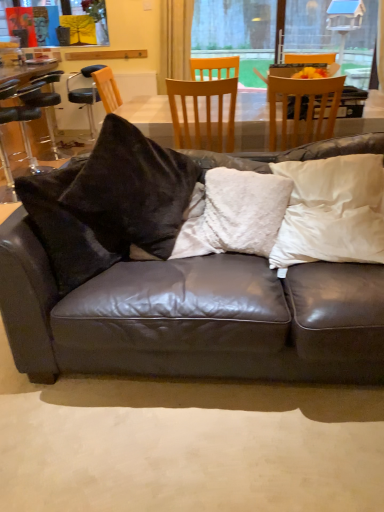
Describe the element at coordinates (300, 106) in the screenshot. I see `light brown wooden chair at upper center, the 3th chair from the left` at that location.

How much space does black leather bar stool at left, which is counted as the third chair, starting from the front, occupy vertically?

The height of black leather bar stool at left, which is counted as the third chair, starting from the front, is 34.92 inches.

This screenshot has height=512, width=384. Describe the element at coordinates (24, 138) in the screenshot. I see `black leather bar stool at left, which is the first chair in left-to-right order` at that location.

The image size is (384, 512). What are the coordinates of `matte black leather couch at center` in the screenshot? It's located at 192,317.

Is point (309, 329) positioned in front of point (4, 123)?

Yes, point (309, 329) is closer to viewer.

Considering the relative positions of matte black leather couch at center and black leather bar stool at left, which is the first chair in left-to-right order, in the image provided, is matte black leather couch at center to the left or to the right of black leather bar stool at left, which is the first chair in left-to-right order,?

Based on their positions, matte black leather couch at center is located to the right of black leather bar stool at left, which is the first chair in left-to-right order.

Looking at this image, is matte black leather couch at center turned away from black leather bar stool at left, which is counted as the third chair, starting from the front?

That's not correct — matte black leather couch at center is not looking away from black leather bar stool at left, which is counted as the third chair, starting from the front.

Between matte black leather couch at center and black leather bar stool at left, the first chair positioned from the back, which one has less height?

Standing shorter between the two is matte black leather couch at center.

From their relative heights in the image, would you say light brown wooden chair at center, the 2th chair in the front-to-back sequence, is taller or shorter than black leather bar stool at left?

In the image, light brown wooden chair at center, the 2th chair in the front-to-back sequence, appears to be shorter than black leather bar stool at left.

Is light brown wooden chair at center, which is the second chair in left-to-right order, not inside black leather bar stool at left?

Yes, light brown wooden chair at center, which is the second chair in left-to-right order, is outside of black leather bar stool at left.

Considering the points (170, 93) and (35, 83), which point is behind, point (170, 93) or point (35, 83)?

The point (35, 83) is behind.

There is a black leather bar stool at left. What are the coordinates of `the 3rd chair above it (from a real-world perspective)` in the screenshot? It's located at (206, 108).

Considering the relative sizes of matte black leather couch at center and fluffy white pillow at center, which appears as the 1th pillow when viewed from the left, in the image provided, is matte black leather couch at center bigger than fluffy white pillow at center, which appears as the 1th pillow when viewed from the left,?

Correct, matte black leather couch at center is larger in size than fluffy white pillow at center, which appears as the 1th pillow when viewed from the left.

Is matte black leather couch at center wider than fluffy white pillow at center, the 2th pillow when ordered from right to left?

Correct, the width of matte black leather couch at center exceeds that of fluffy white pillow at center, the 2th pillow when ordered from right to left.

Could you tell me if matte black leather couch at center is turned towards fluffy white pillow at center, which appears as the 1th pillow when viewed from the left?

Yes, matte black leather couch at center is facing fluffy white pillow at center, which appears as the 1th pillow when viewed from the left.

From a real-world perspective, is matte black leather couch at center on top of fluffy white pillow at center, which appears as the 1th pillow when viewed from the left?

No.

Can you confirm if black leather bar stool at left is taller than fluffy white pillow at center, which appears as the 1th pillow when viewed from the left?

Yes, black leather bar stool at left is taller than fluffy white pillow at center, which appears as the 1th pillow when viewed from the left.

How far apart are black leather bar stool at left and fluffy white pillow at center, the 2th pillow when ordered from right to left?

black leather bar stool at left and fluffy white pillow at center, the 2th pillow when ordered from right to left, are 2.78 meters apart from each other.

Considering the sizes of objects black leather bar stool at left and fluffy white pillow at center, the 2th pillow when ordered from right to left, in the image provided, who is smaller, black leather bar stool at left or fluffy white pillow at center, the 2th pillow when ordered from right to left,?

fluffy white pillow at center, the 2th pillow when ordered from right to left, is smaller.

From the picture: Can you confirm if black leather bar stool at left is wider than fluffy white pillow at center, the 2th pillow when ordered from right to left?

Correct, the width of black leather bar stool at left exceeds that of fluffy white pillow at center, the 2th pillow when ordered from right to left.

Does light brown wooden chair at upper center, which appears as the first chair when viewed from the right, appear on the left side of black leather bar stool at left, which is the first chair in left-to-right order?

No.

Considering the relative sizes of light brown wooden chair at upper center, which is the 3th chair from back to front, and black leather bar stool at left, which is counted as the third chair, starting from the front, in the image provided, is light brown wooden chair at upper center, which is the 3th chair from back to front, bigger than black leather bar stool at left, which is counted as the third chair, starting from the front,?

Incorrect, light brown wooden chair at upper center, which is the 3th chair from back to front, is not larger than black leather bar stool at left, which is counted as the third chair, starting from the front.

How different are the orientations of light brown wooden chair at upper center, which is the 3th chair from back to front, and black leather bar stool at left, placed as the third chair when sorted from right to left, in degrees?

The angle between the facing direction of light brown wooden chair at upper center, which is the 3th chair from back to front, and the facing direction of black leather bar stool at left, placed as the third chair when sorted from right to left, is 88.8 degrees.

Would you say yellow fabric at upper left is inside or outside black leather bar stool at left, placed as the third chair when sorted from right to left?

yellow fabric at upper left cannot be found inside black leather bar stool at left, placed as the third chair when sorted from right to left.

Considering the positions of objects yellow fabric at upper left and black leather bar stool at left, placed as the third chair when sorted from right to left, in the image provided, who is more to the left, yellow fabric at upper left or black leather bar stool at left, placed as the third chair when sorted from right to left,?

From the viewer's perspective, black leather bar stool at left, placed as the third chair when sorted from right to left, appears more on the left side.

Between yellow fabric at upper left and black leather bar stool at left, which is counted as the third chair, starting from the front, which one has more height?

black leather bar stool at left, which is counted as the third chair, starting from the front.

Considering the relative sizes of yellow fabric at upper left and black leather bar stool at left, placed as the third chair when sorted from right to left, in the image provided, is yellow fabric at upper left thinner than black leather bar stool at left, placed as the third chair when sorted from right to left,?

Yes.

From a real-world perspective, is light brown wooden chair at upper center, which appears as the first chair when viewed from the right, positioned under fluffy white pillow at center, which appears as the 1th pillow when viewed from the left, based on gravity?

No.

Considering the relative sizes of light brown wooden chair at upper center, the 3th chair from the left, and fluffy white pillow at center, the 2th pillow when ordered from right to left, in the image provided, is light brown wooden chair at upper center, the 3th chair from the left, shorter than fluffy white pillow at center, the 2th pillow when ordered from right to left,?

No.

From the image's perspective, does light brown wooden chair at upper center, which appears as the first chair when viewed from the right, appear higher than fluffy white pillow at center, which appears as the 1th pillow when viewed from the left?

Indeed, from the image's perspective, light brown wooden chair at upper center, which appears as the first chair when viewed from the right, is shown above fluffy white pillow at center, which appears as the 1th pillow when viewed from the left.

Considering the relative positions of light brown wooden chair at upper center, which appears as the first chair when viewed from the right, and fluffy white pillow at center, the 2th pillow when ordered from right to left, in the image provided, is light brown wooden chair at upper center, which appears as the first chair when viewed from the right, to the right of fluffy white pillow at center, the 2th pillow when ordered from right to left, from the viewer's perspective?

Correct, you'll find light brown wooden chair at upper center, which appears as the first chair when viewed from the right, to the right of fluffy white pillow at center, the 2th pillow when ordered from right to left.

This screenshot has height=512, width=384. I want to click on studio couch on the right of black leather bar stool at left, placed as the third chair when sorted from right to left, so click(x=192, y=317).

Find the location of a particular element. The width and height of the screenshot is (384, 512). bar stool on the left of light brown wooden chair at center, marked as the second chair in a right-to-left arrangement is located at coordinates (45, 106).

Based on their spatial positions, is white soft pillow at right, which ranks as the first pillow in right-to-left order, or light brown wooden chair at upper center, which is the 3th chair from back to front, further from black leather bar stool at left?

white soft pillow at right, which ranks as the first pillow in right-to-left order, is further to black leather bar stool at left.

In the scene shown: Which object lies further to the anchor point matte black leather couch at center, light brown wooden chair at upper center, which appears as the 1th chair when viewed from the front, or black leather bar stool at left, placed as the third chair when sorted from right to left?

The object further to matte black leather couch at center is black leather bar stool at left, placed as the third chair when sorted from right to left.

Considering their positions, is black leather bar stool at left positioned further to light brown wooden chair at upper center, which is the 3th chair from back to front, than yellow fabric at upper left?

The object further to light brown wooden chair at upper center, which is the 3th chair from back to front, is yellow fabric at upper left.

When comparing their distances from white soft pillow at right, which ranks as the first pillow in right-to-left order, does matte black leather couch at center or light brown wooden chair at center, which is counted as the second chair, starting from the back, seem further?

light brown wooden chair at center, which is counted as the second chair, starting from the back, is further to white soft pillow at right, which ranks as the first pillow in right-to-left order.

From the image, which object appears to be farther from fluffy white pillow at center, the 2th pillow when ordered from right to left, light brown wooden chair at center, the 2th chair in the front-to-back sequence, or matte black leather couch at center?

light brown wooden chair at center, the 2th chair in the front-to-back sequence, is positioned further to the anchor fluffy white pillow at center, the 2th pillow when ordered from right to left.

From the image, which object appears to be farther from matte black leather couch at center, black leather bar stool at left or white soft pillow at right, the second pillow viewed from the left?

Among the two, black leather bar stool at left is located further to matte black leather couch at center.

Considering their positions, is light brown wooden chair at center, marked as the second chair in a right-to-left arrangement, positioned closer to light brown wooden chair at upper center, which is the 3th chair from back to front, than fluffy white pillow at center, which appears as the 1th pillow when viewed from the left?

light brown wooden chair at center, marked as the second chair in a right-to-left arrangement, lies closer to light brown wooden chair at upper center, which is the 3th chair from back to front, than the other object.

Looking at the image, which one is located closer to light brown wooden chair at upper center, which appears as the first chair when viewed from the right, light brown wooden chair at center, the 2th chair in the front-to-back sequence, or black leather bar stool at left?

light brown wooden chair at center, the 2th chair in the front-to-back sequence, is positioned closer to the anchor light brown wooden chair at upper center, which appears as the first chair when viewed from the right.

Identify the location of bar stool between yellow fabric at upper left and black leather bar stool at left, the first chair positioned from the back, from top to bottom. This screenshot has height=512, width=384. (45, 106).

Where is `pillow located between black leather bar stool at left, the first chair positioned from the back, and white soft pillow at right, the second pillow viewed from the left, in the left-right direction`? This screenshot has width=384, height=512. pillow located between black leather bar stool at left, the first chair positioned from the back, and white soft pillow at right, the second pillow viewed from the left, in the left-right direction is located at coordinates (234, 214).

Find the location of `chair located between black leather bar stool at left, which is counted as the third chair, starting from the front, and light brown wooden chair at upper center, which appears as the 1th chair when viewed from the front, in the left-right direction`. chair located between black leather bar stool at left, which is counted as the third chair, starting from the front, and light brown wooden chair at upper center, which appears as the 1th chair when viewed from the front, in the left-right direction is located at coordinates (206, 108).

The width and height of the screenshot is (384, 512). In order to click on bar stool between black leather bar stool at left, which is the first chair in left-to-right order, and light brown wooden chair at upper center, which appears as the first chair when viewed from the right, from left to right in this screenshot , I will do [x=45, y=106].